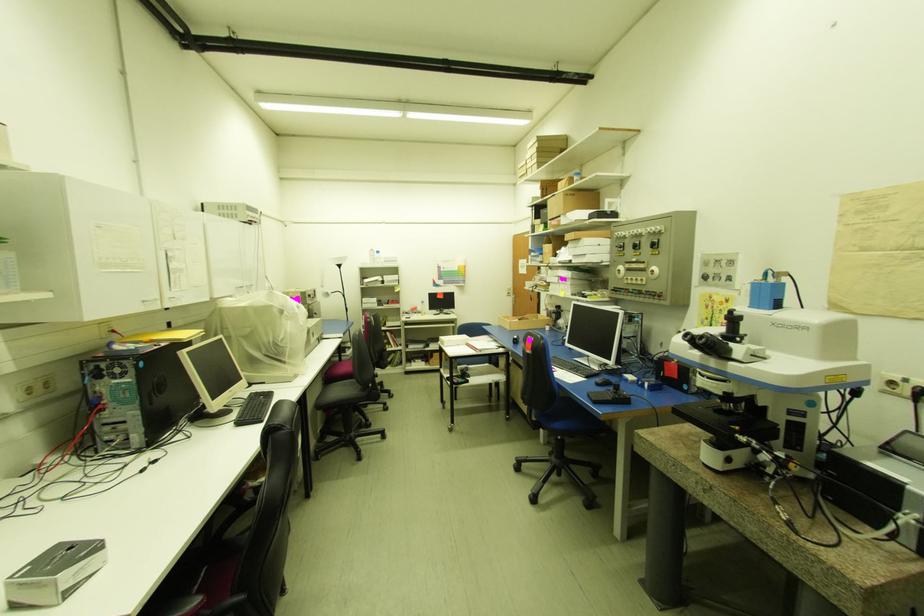
Where is `black keyboard`? The height and width of the screenshot is (616, 924). black keyboard is located at coordinates pos(253,408).